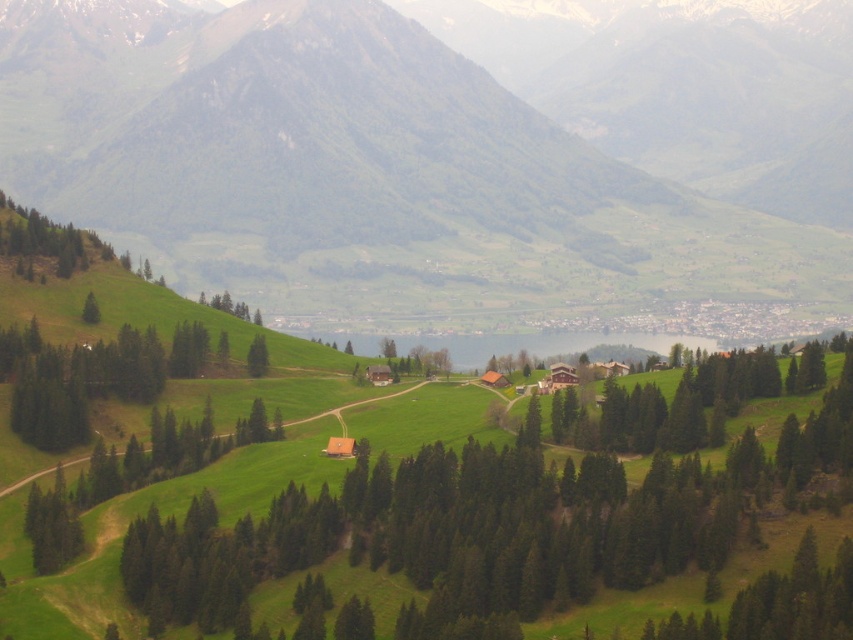
At what (x,y) coordinates should I click in order to perform the action: click on green grassy hillside at center. Please return your answer as a coordinate pair (x, y). The height and width of the screenshot is (640, 853). Looking at the image, I should click on (453, 160).

Is green grassy hillside at center shorter than green matte tree at upper left?

Incorrect, green grassy hillside at center's height does not fall short of green matte tree at upper left's.

I want to click on green grassy hillside at center, so 453,160.

Between point (193, 200) and point (257, 364), which one is positioned in front?

Point (257, 364) is in front.

Is green grassy hillside at center shorter than green matte tree at center?

In fact, green grassy hillside at center may be taller than green matte tree at center.

Where is `green grassy hillside at center`? The image size is (853, 640). green grassy hillside at center is located at coordinates (453, 160).

Image resolution: width=853 pixels, height=640 pixels. What are the coordinates of `green grassy hillside at center` in the screenshot? It's located at (453, 160).

From the picture: Which is more to the left, green matte tree at center or green matte tree at upper left?

Positioned to the left is green matte tree at upper left.

Identify the location of green matte tree at center. Image resolution: width=853 pixels, height=640 pixels. (257, 356).